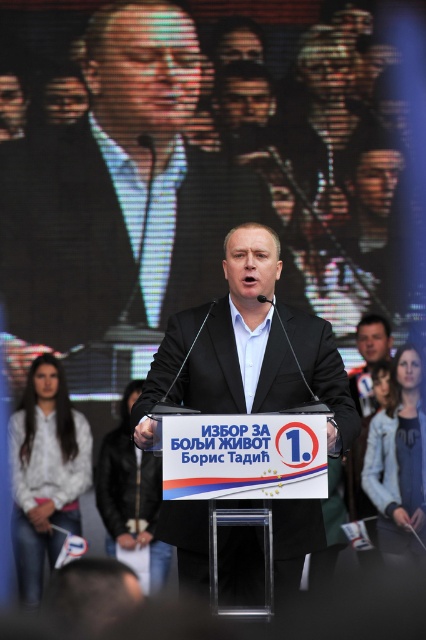
Question: Does black matte suit at center appear over matte black suit at center?

Choices:
 (A) no
 (B) yes

Answer: (B)

Question: Which object appears closest to the camera in this image?

Choices:
 (A) black matte suit at center
 (B) matte black suit at center

Answer: (B)

Question: Is black matte suit at center smaller than matte black suit at center?

Choices:
 (A) yes
 (B) no

Answer: (B)

Question: In this image, where is black matte suit at center located relative to matte black suit at center?

Choices:
 (A) left
 (B) right

Answer: (A)